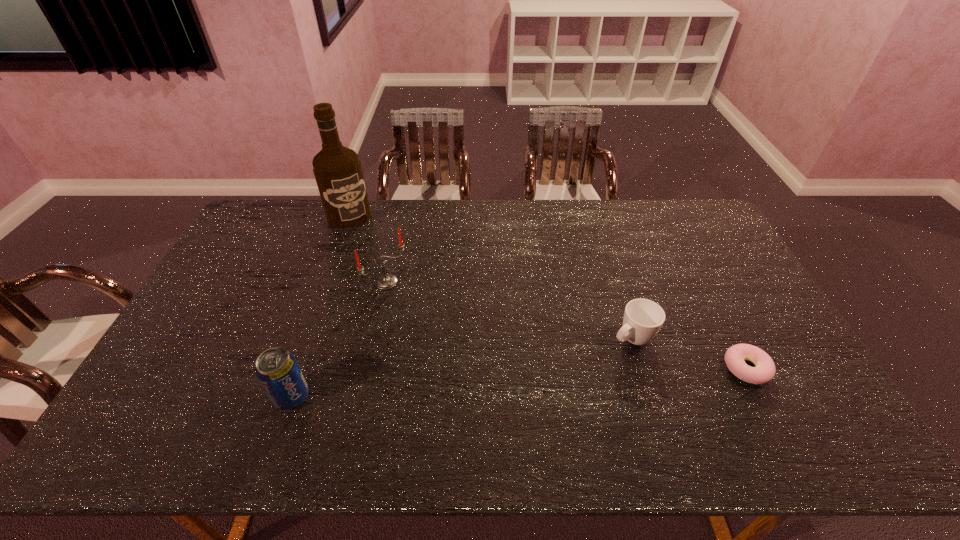
Identify the location of free space on the desktop that is between the third shortest object and the doughnut and is positioned on the front-facing side of the third object from right to left. (510, 383).

At what (x,y) coordinates should I click in order to perform the action: click on free space on the desktop that is between the soda and the rightmost object and is positioned with the handle on the side of the second shortest object. Please return your answer as a coordinate pair (x, y). Looking at the image, I should click on coord(575,379).

Where is `free spot on the desktop that is between the third shortest object and the rightmost object and is positioned on the label of the farthest object`? Image resolution: width=960 pixels, height=540 pixels. free spot on the desktop that is between the third shortest object and the rightmost object and is positioned on the label of the farthest object is located at coordinates (468, 386).